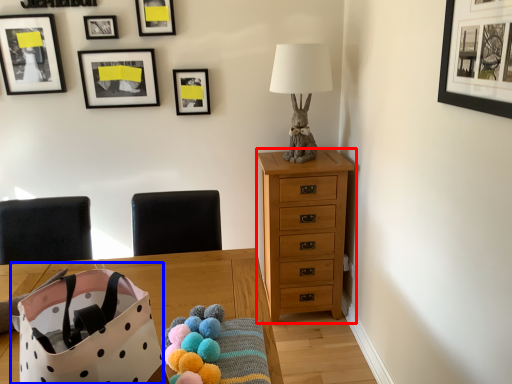
Question: Which point is closer to the camera, chest of drawers (highlighted by a red box) or gift bag (highlighted by a blue box)?

Choices:
 (A) chest of drawers
 (B) gift bag

Answer: (B)